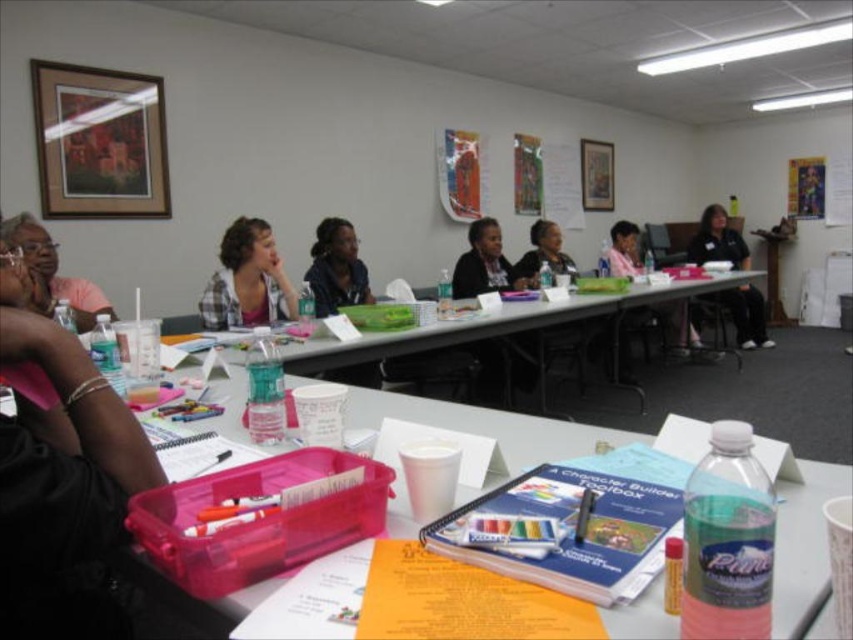
You are organizing a workshop and need to place a large poster on the table. The metallic poster at upper right is 2 meters wide. Can the white plastic table at center, which is larger in size, accommodate the poster without folding it?

The white plastic table at center is larger in size than the metallic poster at upper right, so it can accommodate the poster without folding it.

You are organizing a workshop and need to place a large poster on the table. The poster is as wide as the black fabric shirt at right. Will it fit on the translucent plastic table at center?

The translucent plastic table at center might be wider than black fabric shirt at right, so the poster should fit since the table is likely wider than the shirt.

You are a participant in the meeting and want to place your matte pink shirt at upper left on the white plastic table at center. Will it fit on the table?

The white plastic table at center has a greater height compared to matte pink shirt at upper left, so the matte pink shirt at upper left will fit on the table.